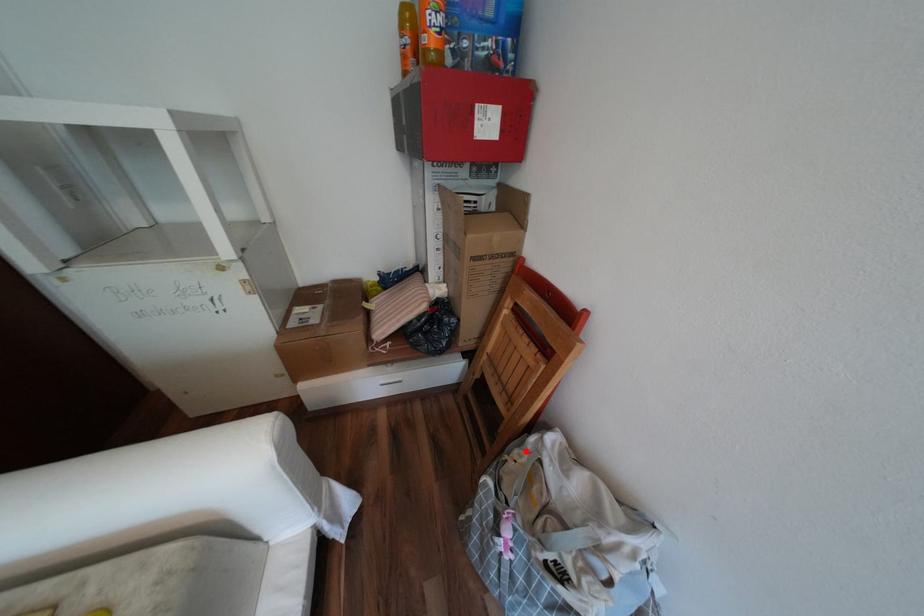
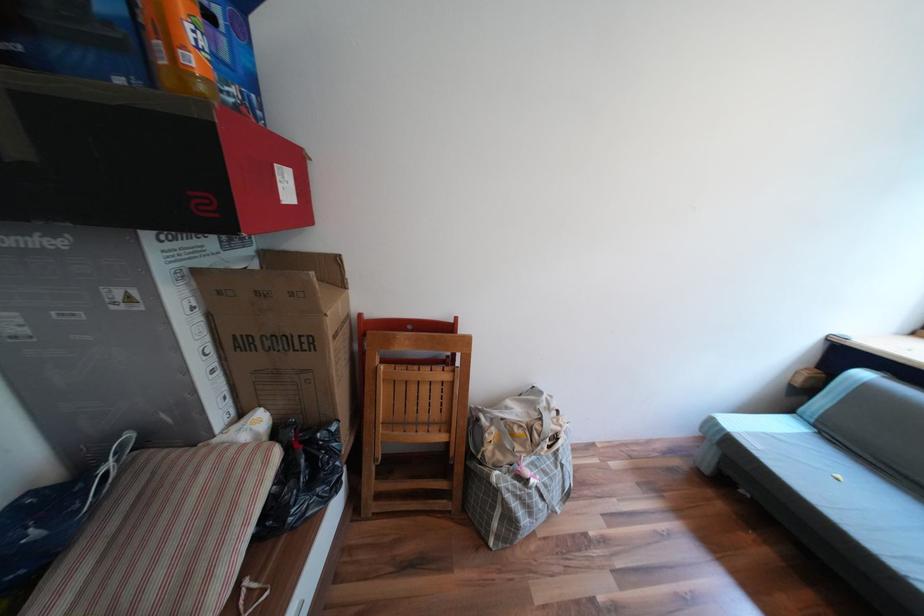
Where in the second image is the point corresponding to the highlighted location from the first image?

(495, 435)